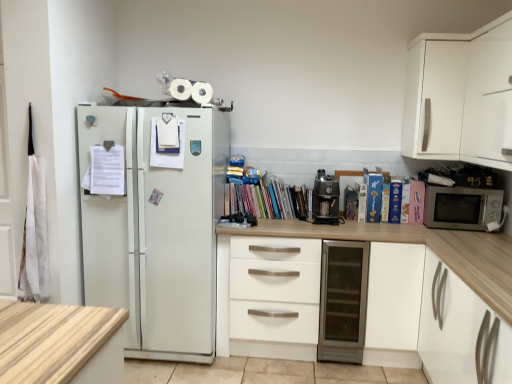
Question: From the image's perspective, relative to white matte cabinet at lower right, arranged as the 2th cabinetry when viewed from the top, is metallic glass door fridge at center above or below?

Choices:
 (A) above
 (B) below

Answer: (B)

Question: From a real-world perspective, relative to white matte cabinet at lower right, marked as the first cabinetry in a bottom-to-top arrangement, is metallic glass door fridge at center vertically above or below?

Choices:
 (A) below
 (B) above

Answer: (A)

Question: Which is farther from the white matte cabinet at upper right, acting as the 1th cabinetry starting from the top?

Choices:
 (A) multicolored paperbacks at center
 (B) white matte chest of drawers at center
 (C) pink matte paperback book at right, acting as the 1th paperback book starting from the right
 (D) metallic glass door fridge at center
 (E) hardcover book at right, the 4th paperback book from the left

Answer: (B)

Question: Which is farther from the blue matte paperback book at upper right, which appears as the fifth paperback book when viewed from the right?

Choices:
 (A) white matte cabinet at lower right, arranged as the 2th cabinetry when viewed from the top
 (B) hardcover book at right, which is the 4th paperback book in right-to-left order
 (C) hardcover book at right, positioned as the third paperback book in right-to-left order
 (D) white matte cabinet at upper right, the second cabinetry from the bottom
 (E) metallic glass door fridge at center

Answer: (A)